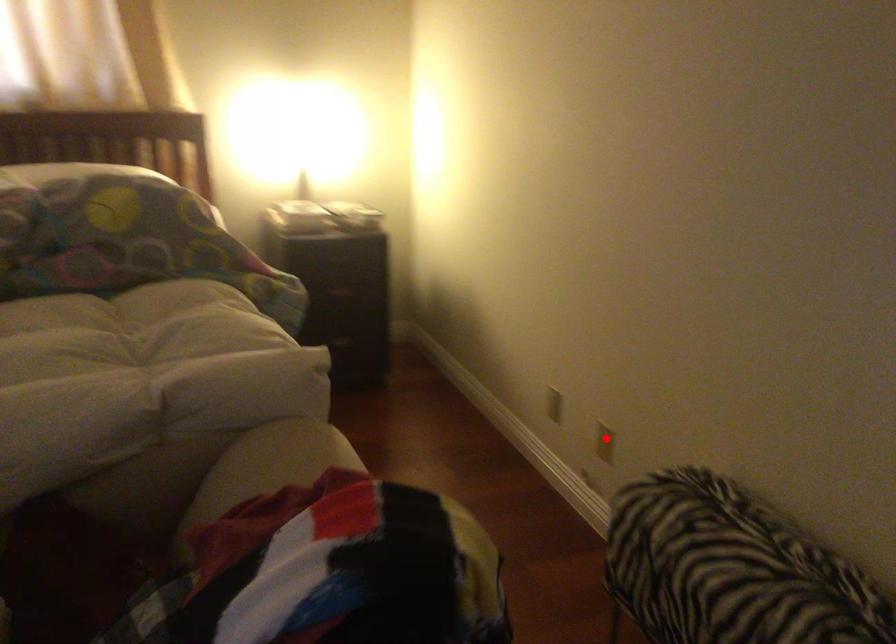
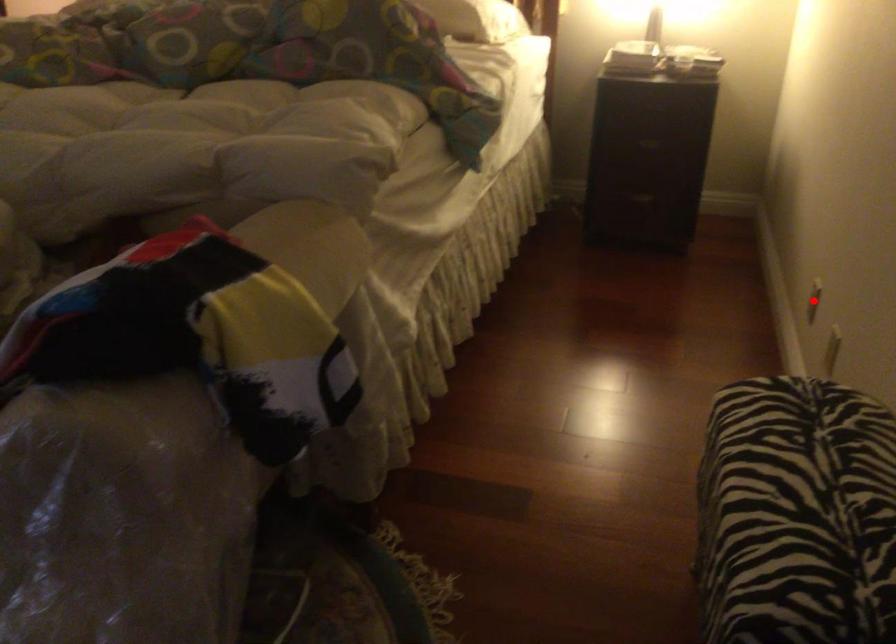
I am providing you with two images of the same scene from different viewpoints. A red point is marked on the first image and another point is marked on the second image. Are the points marked in image1 and image2 representing the same 3D position?

No